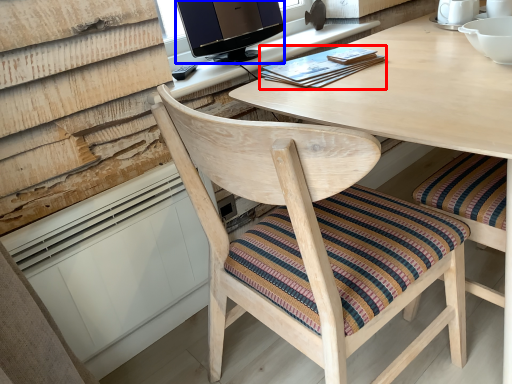
Question: Among these objects, which one is farthest to the camera, book (highlighted by a red box) or television (highlighted by a blue box)?

Choices:
 (A) book
 (B) television

Answer: (B)